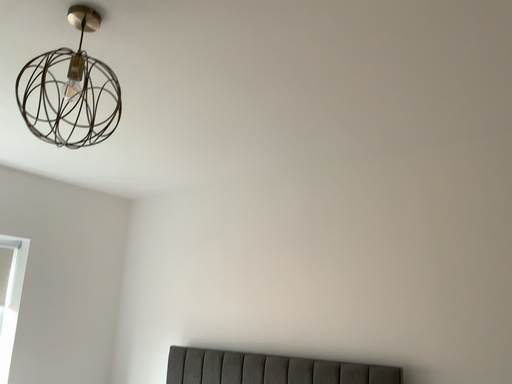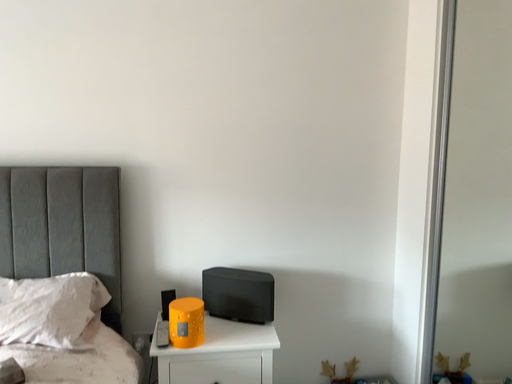
Question: How did the camera likely rotate when shooting the video?

Choices:
 (A) rotated downward
 (B) rotated upward

Answer: (A)